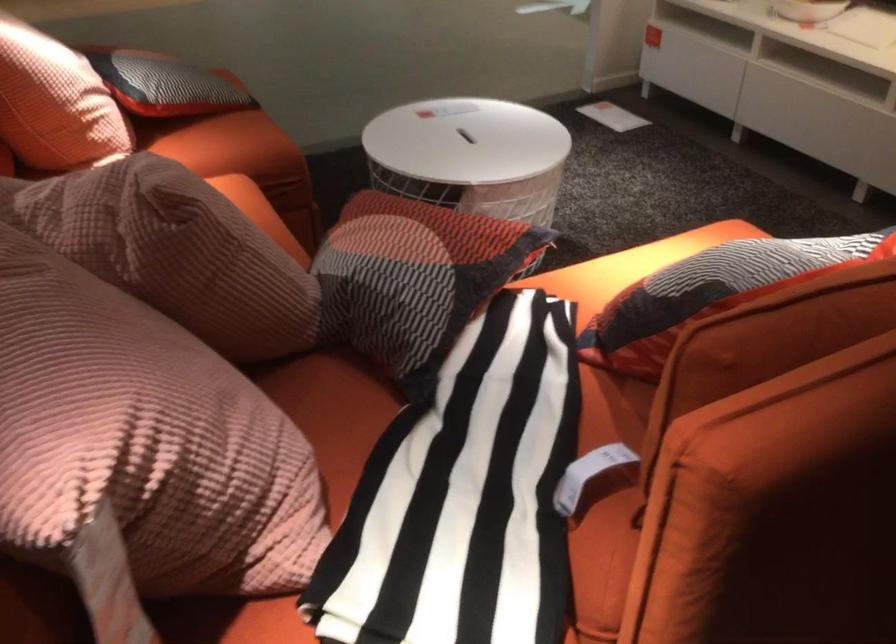
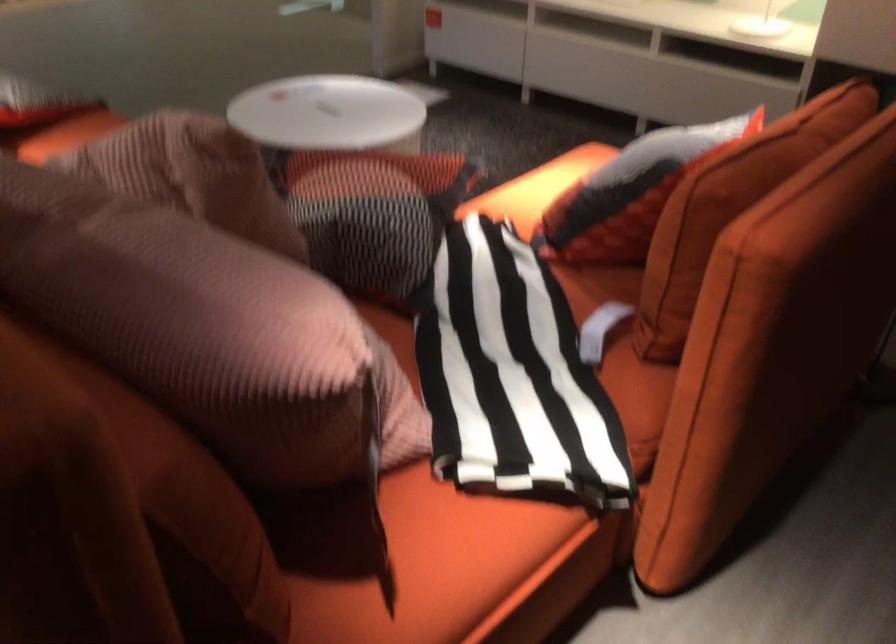
Question: The camera is either moving clockwise (left) or counter-clockwise (right) around the object. The first image is from the beginning of the video and the second image is from the end. Is the camera moving left or right when shooting the video?

Choices:
 (A) Left
 (B) Right

Answer: (A)